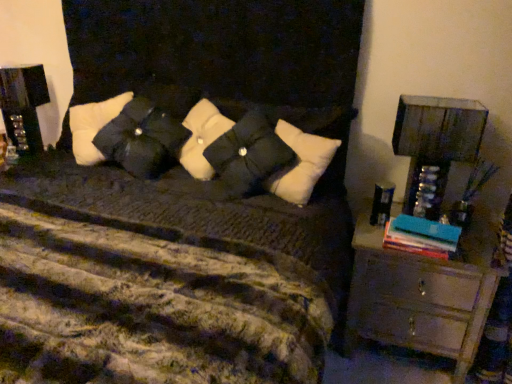
Where is `free space above teal matte book at right (from a real-world perspective)`? The image size is (512, 384). free space above teal matte book at right (from a real-world perspective) is located at coordinates (424, 225).